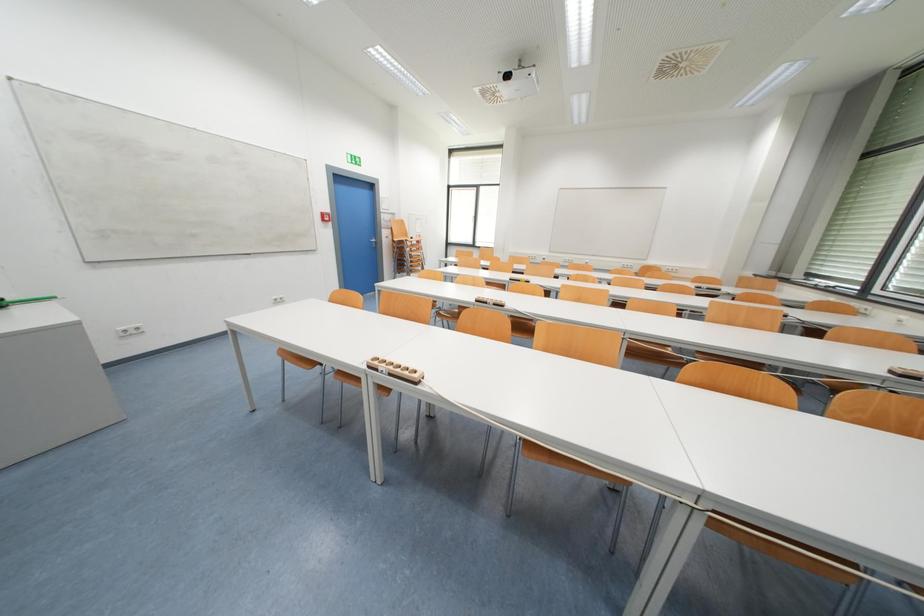
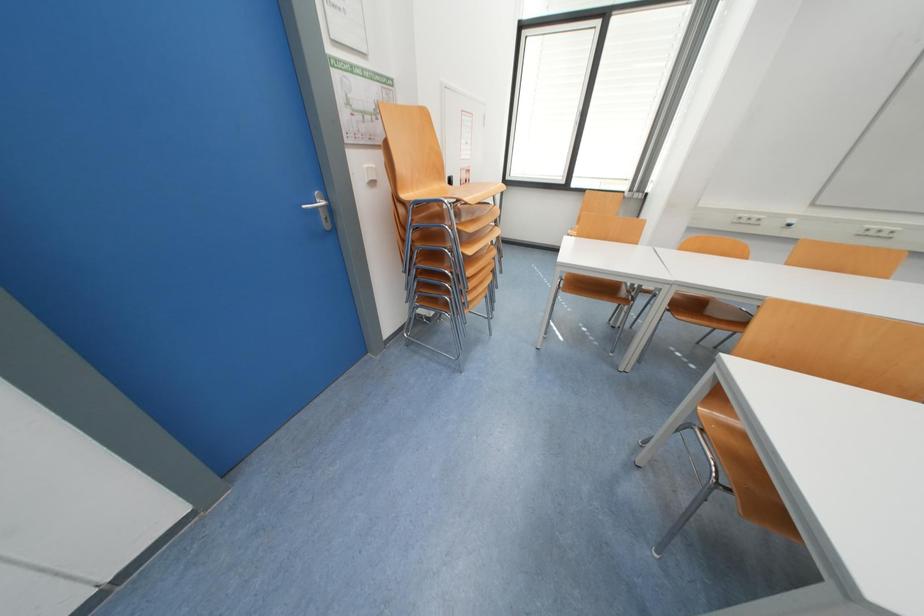
Question: What movement of the cameraman would produce the second image?

Choices:
 (A) Left
 (B) Right
 (C) Forward
 (D) Backward

Answer: (C)